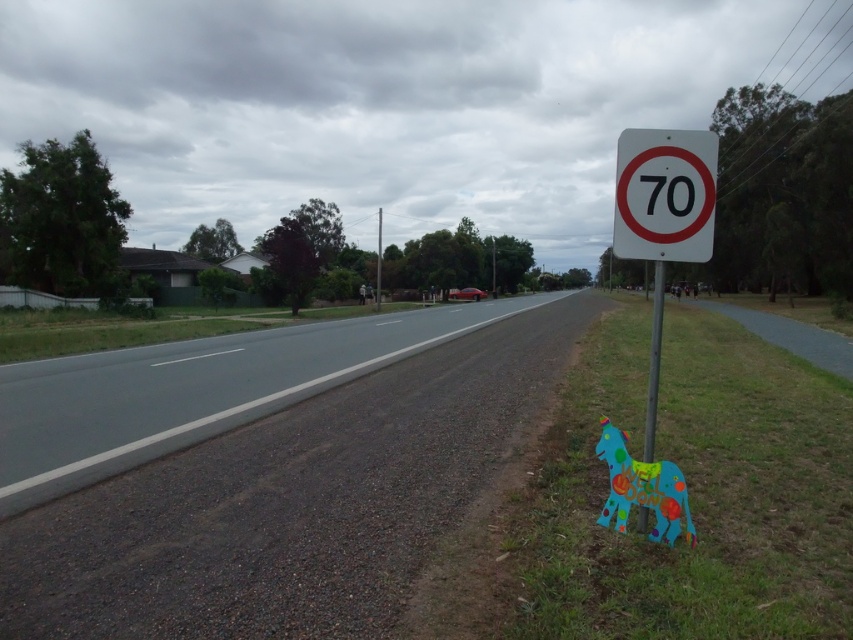
Does white plastic speed limit sign at right appear on the right side of metallic pole at right?

Yes, white plastic speed limit sign at right is to the right of metallic pole at right.

Which is below, white plastic speed limit sign at right or metallic pole at right?

metallic pole at right

Measure the distance between white plastic speed limit sign at right and camera.

The distance of white plastic speed limit sign at right from camera is 4.23 meters.

Locate an element on the screen. white plastic speed limit sign at right is located at coordinates (663, 218).

Between point (682, 225) and point (379, 236), which one is positioned in front?

Point (682, 225) is in front.

Image resolution: width=853 pixels, height=640 pixels. Identify the location of white plastic speed limit sign at right. (663, 218).

The width and height of the screenshot is (853, 640). I want to click on white plastic speed limit sign at right, so click(x=663, y=218).

Is white plastic speed limit sign at right positioned before white plastic speed limit sign at upper right?

No.

Does white plastic speed limit sign at right have a lesser width compared to white plastic speed limit sign at upper right?

No, white plastic speed limit sign at right is not thinner than white plastic speed limit sign at upper right.

Measure the distance between white plastic speed limit sign at right and camera.

The distance of white plastic speed limit sign at right from camera is 4.23 meters.

Image resolution: width=853 pixels, height=640 pixels. I want to click on white plastic speed limit sign at right, so click(x=663, y=218).